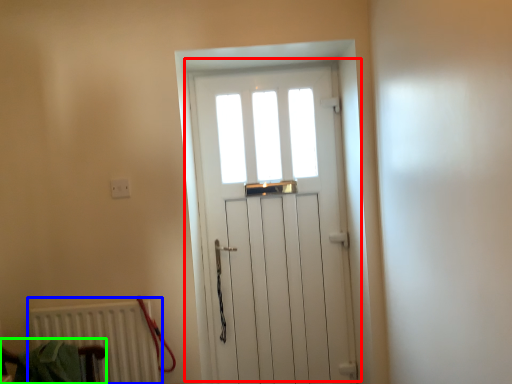
Question: Estimate the real-world distances between objects in this image. Which object is closer to door (highlighted by a red box), radiator (highlighted by a blue box) or armchair (highlighted by a green box)?

Choices:
 (A) radiator
 (B) armchair

Answer: (A)